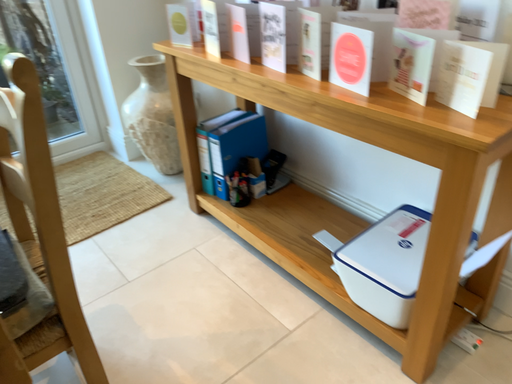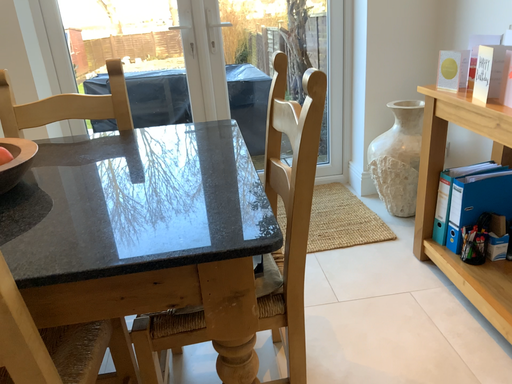
Question: Which way did the camera rotate in the video?

Choices:
 (A) rotated left
 (B) rotated right

Answer: (A)